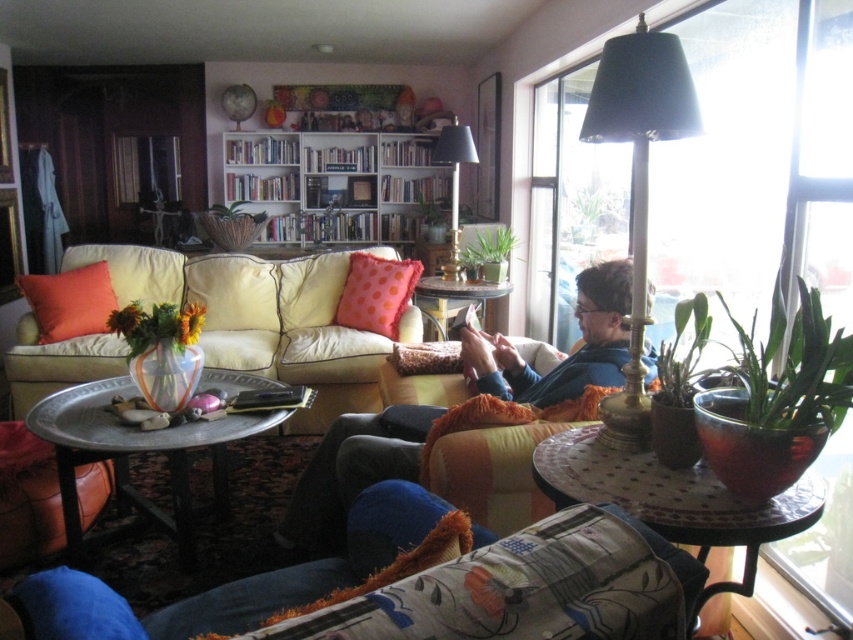
Where is the blue fleece sweater at center located in the image?

The blue fleece sweater at center is located at point (352, 472).

You are standing in the living room and want to look outside through the transparent glass window at upper right. However, there is a wooden bookshelf at upper center blocking your view. Can you see the window clearly?

The transparent glass window at upper right is in front of the wooden bookshelf at upper center, so you can see the window clearly as it is not obstructed by the bookshelf.